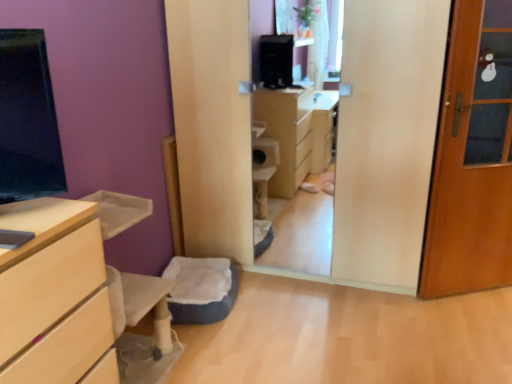
Question: From a real-world perspective, is wooden door at right under soft gray cushion at lower center?

Choices:
 (A) yes
 (B) no

Answer: (B)

Question: Can soft gray cushion at lower center be found inside wooden door at right?

Choices:
 (A) yes
 (B) no

Answer: (B)

Question: Considering the relative positions of wooden door at right and soft gray cushion at lower center in the image provided, is wooden door at right in front of soft gray cushion at lower center?

Choices:
 (A) yes
 (B) no

Answer: (A)

Question: Is wooden door at right taller than soft gray cushion at lower center?

Choices:
 (A) no
 (B) yes

Answer: (B)

Question: Is wooden door at right next to soft gray cushion at lower center and touching it?

Choices:
 (A) yes
 (B) no

Answer: (B)

Question: Is soft gray cushion at lower center spatially inside light wood chest of drawers at left, or outside of it?

Choices:
 (A) inside
 (B) outside

Answer: (B)

Question: Considering the relative positions of soft gray cushion at lower center and light wood chest of drawers at left in the image provided, is soft gray cushion at lower center to the left or to the right of light wood chest of drawers at left?

Choices:
 (A) right
 (B) left

Answer: (A)

Question: Looking at the image, does soft gray cushion at lower center seem bigger or smaller compared to light wood chest of drawers at left?

Choices:
 (A) small
 (B) big

Answer: (A)

Question: From their relative heights in the image, would you say soft gray cushion at lower center is taller or shorter than light wood chest of drawers at left?

Choices:
 (A) short
 (B) tall

Answer: (A)

Question: Is wooden door at right in front of or behind light wood chest of drawers at left in the image?

Choices:
 (A) front
 (B) behind

Answer: (B)

Question: Is wooden door at right situated inside light wood chest of drawers at left or outside?

Choices:
 (A) inside
 (B) outside

Answer: (B)

Question: Considering the positions of wooden door at right and light wood chest of drawers at left in the image, is wooden door at right bigger or smaller than light wood chest of drawers at left?

Choices:
 (A) big
 (B) small

Answer: (B)

Question: Considering the relative positions of wooden door at right and light wood chest of drawers at left in the image provided, is wooden door at right to the left or to the right of light wood chest of drawers at left?

Choices:
 (A) left
 (B) right

Answer: (B)

Question: Looking at the image, does light wood chest of drawers at left seem bigger or smaller compared to wooden door at right?

Choices:
 (A) small
 (B) big

Answer: (B)

Question: Is light wood chest of drawers at left wider or thinner than wooden door at right?

Choices:
 (A) wide
 (B) thin

Answer: (A)